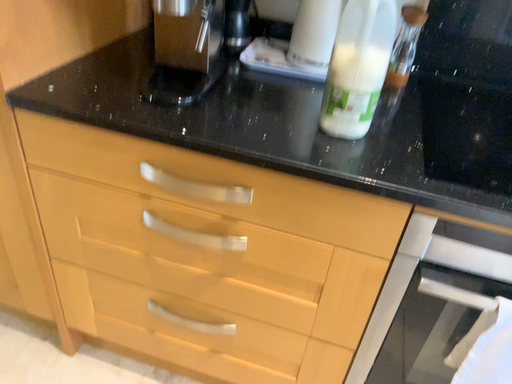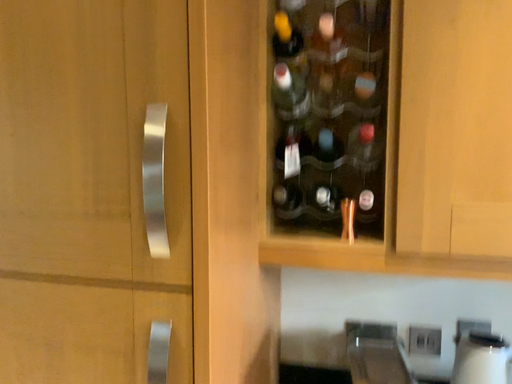
Question: Which way did the camera rotate in the video?

Choices:
 (A) rotated downward
 (B) rotated upward

Answer: (B)